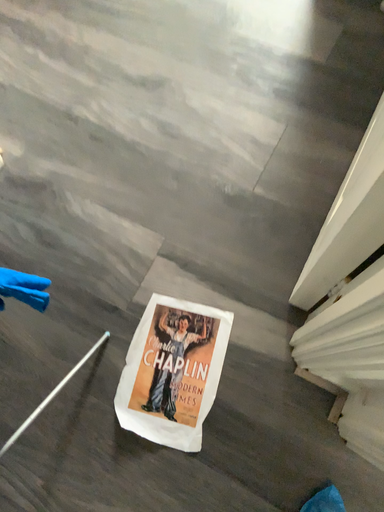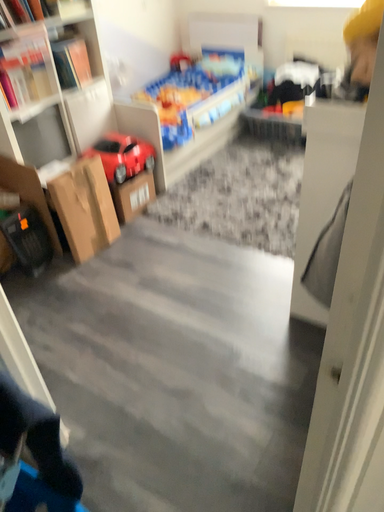
Question: Which way did the camera rotate in the video?

Choices:
 (A) rotated downward
 (B) rotated upward

Answer: (B)